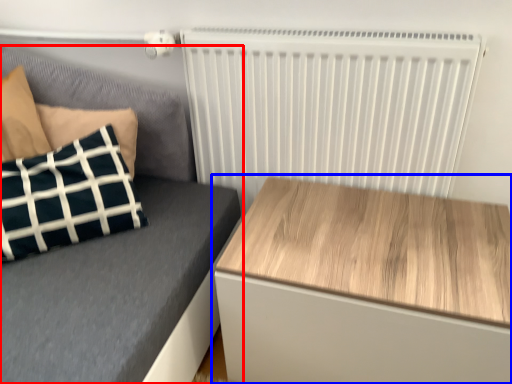
Question: Which object appears farthest to the camera in this image, furniture (highlighted by a red box) or table (highlighted by a blue box)?

Choices:
 (A) furniture
 (B) table

Answer: (A)